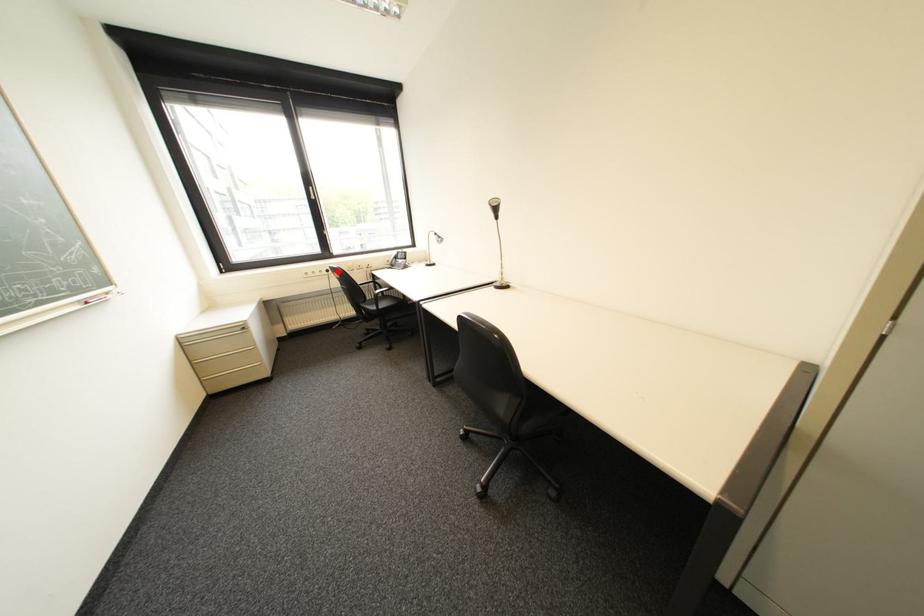
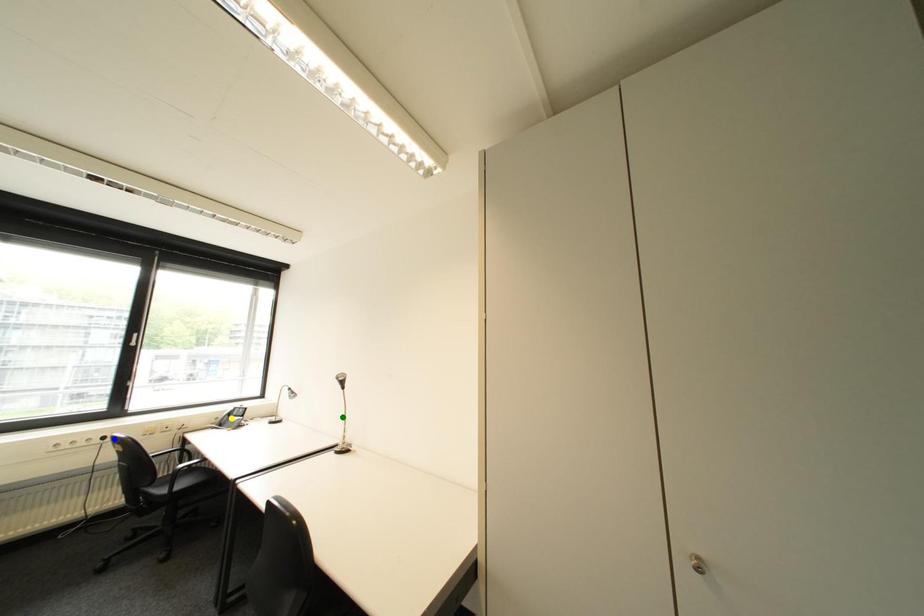
Question: I am providing you with two images of the same scene from different viewpoints. A red point is marked on the first image. You are given multiple points on the second image. Which spot in image 2 lines up with the point in image 1?

Choices:
 (A) green point
 (B) yellow point
 (C) blue point

Answer: (C)